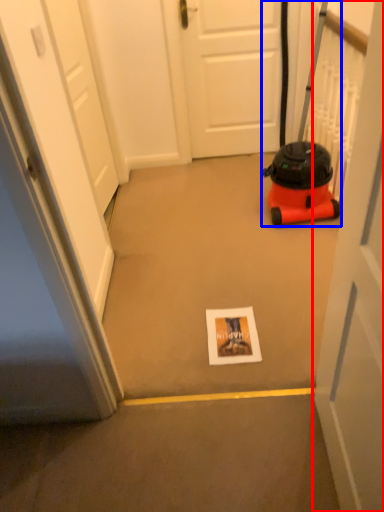
Question: Among these objects, which one is farthest to the camera, door (highlighted by a red box) or equipment (highlighted by a blue box)?

Choices:
 (A) door
 (B) equipment

Answer: (B)